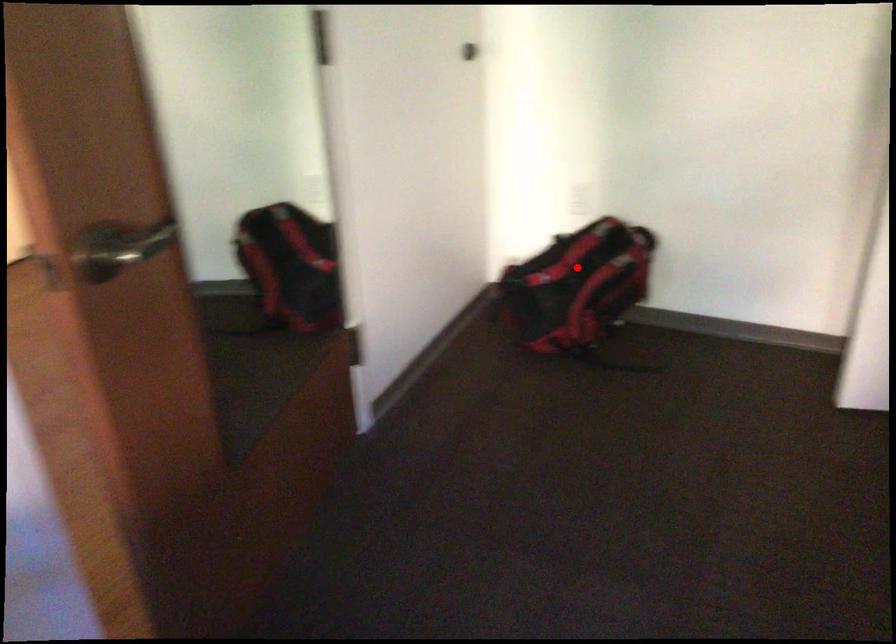
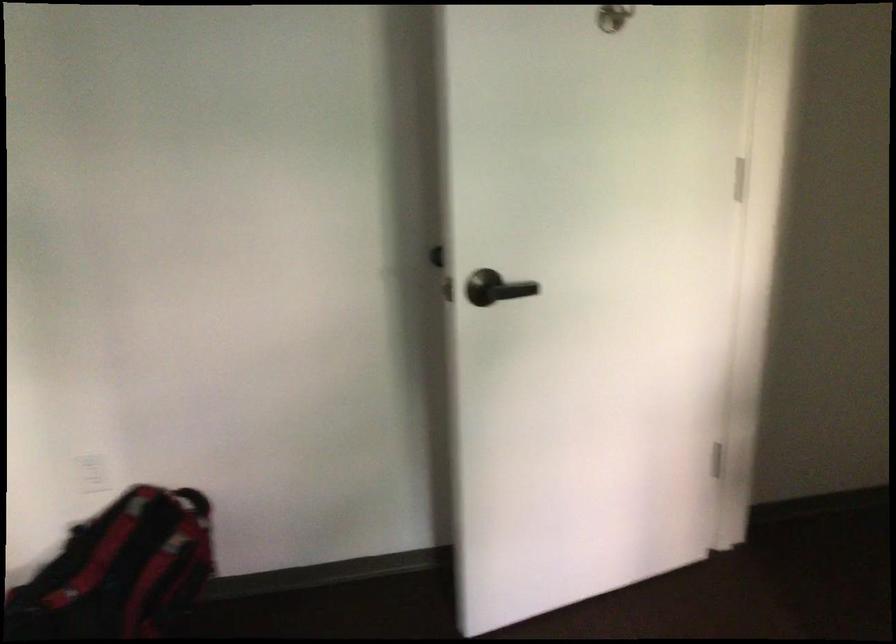
Where in the second image is the point corresponding to the highlighted location from the first image?

(119, 570)